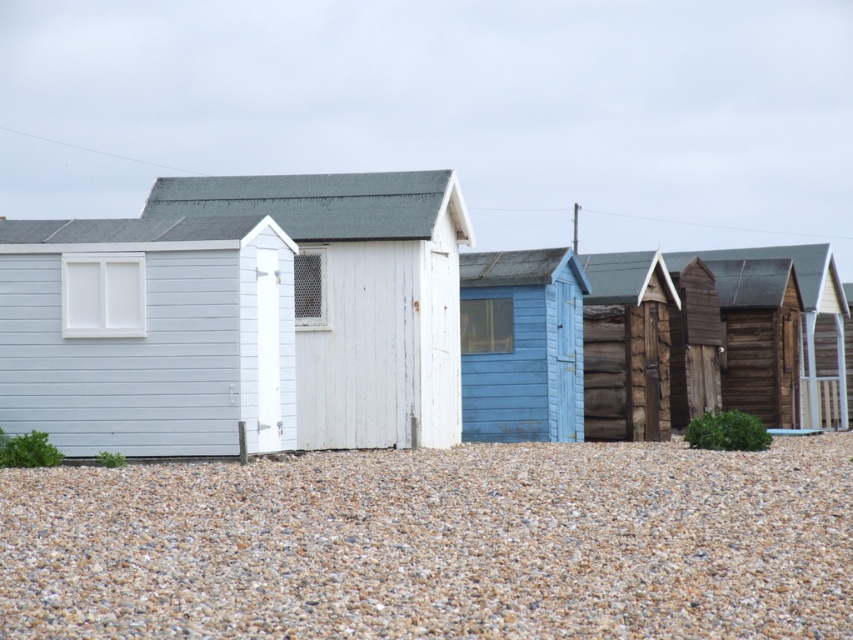
Question: Which object is positioned closest to the wooden cabin at center?

Choices:
 (A) brown pebbled gravel at lower center
 (B) white wooden beach hut at center

Answer: (A)

Question: Which object appears farthest from the camera in this image?

Choices:
 (A) brown pebbled gravel at lower center
 (B) white wooden beach hut at center
 (C) wooden cabin at center
 (D) light blue wooden hut at center

Answer: (C)

Question: Which point is farther to the camera?

Choices:
 (A) brown pebbled gravel at lower center
 (B) white wooden beach hut at center

Answer: (B)

Question: Does brown pebbled gravel at lower center appear on the left side of wooden cabin at center?

Choices:
 (A) no
 (B) yes

Answer: (B)

Question: Does white wooden beach hut at center appear over wooden cabin at center?

Choices:
 (A) yes
 (B) no

Answer: (B)

Question: Does brown pebbled gravel at lower center appear over white wooden beach hut at center?

Choices:
 (A) no
 (B) yes

Answer: (A)